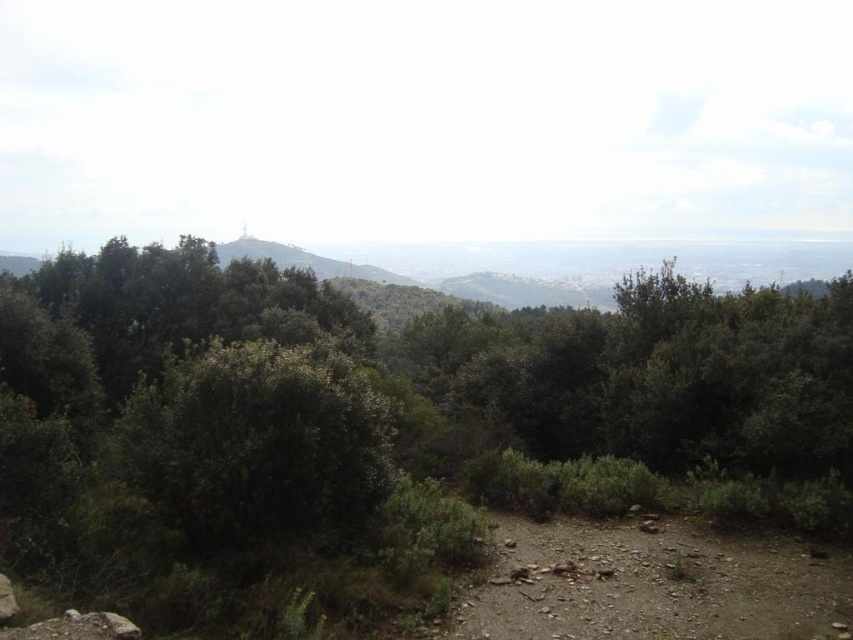
From the picture: Can you confirm if green leafy forest at center is smaller than brown rocky dirt track at lower right?

Incorrect, green leafy forest at center is not smaller in size than brown rocky dirt track at lower right.

What do you see at coordinates (384, 416) in the screenshot? This screenshot has width=853, height=640. I see `green leafy forest at center` at bounding box center [384, 416].

Where is `green leafy forest at center`? The width and height of the screenshot is (853, 640). green leafy forest at center is located at coordinates (384, 416).